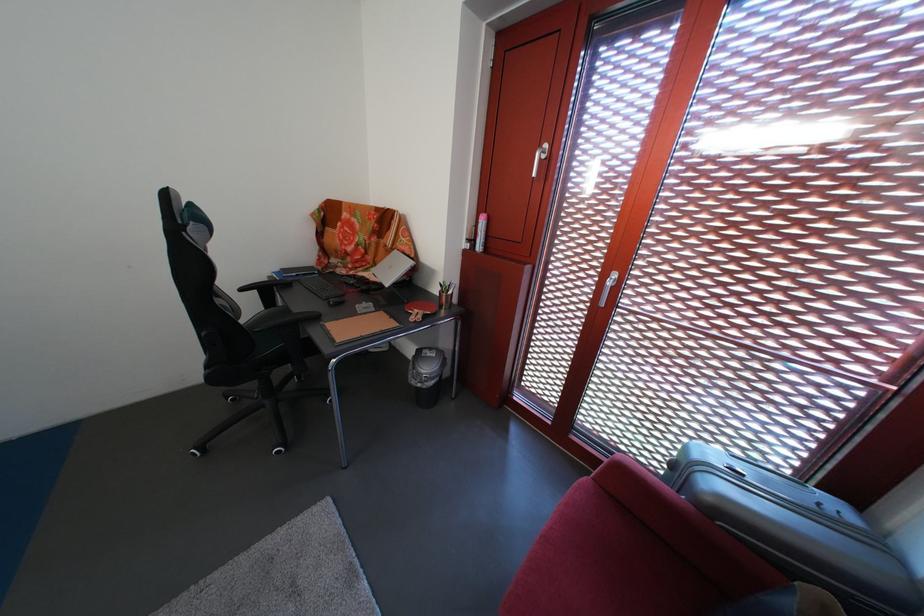
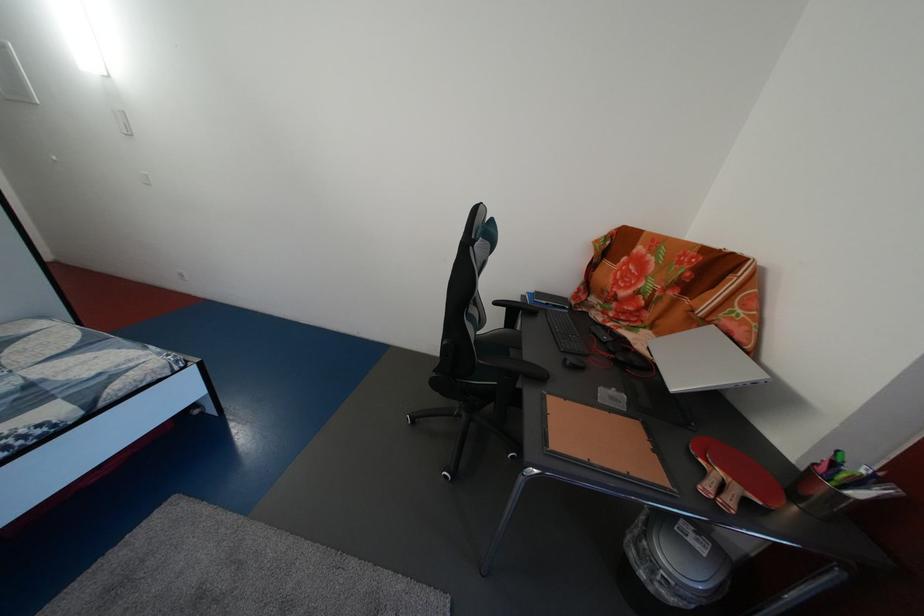
Where in the second image is the point corresponding to [384,276] from the first image?

(657, 339)